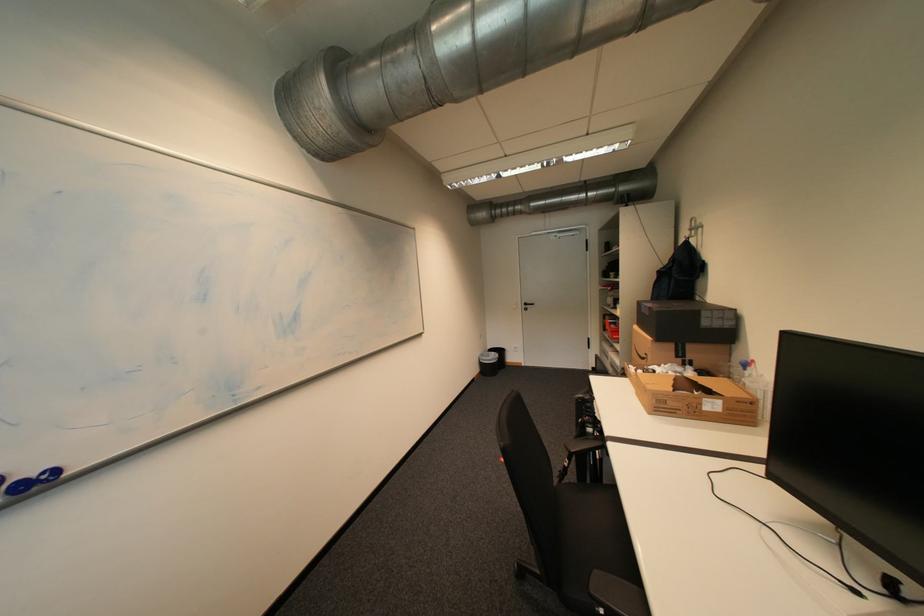
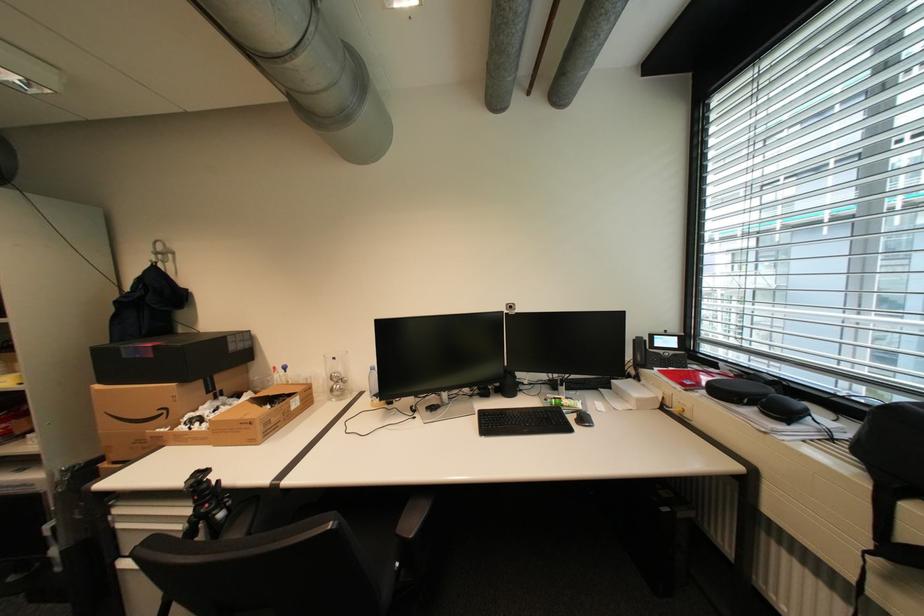
In the second image, find the point that corresponds to pixel 597 406 in the first image.

(213, 485)